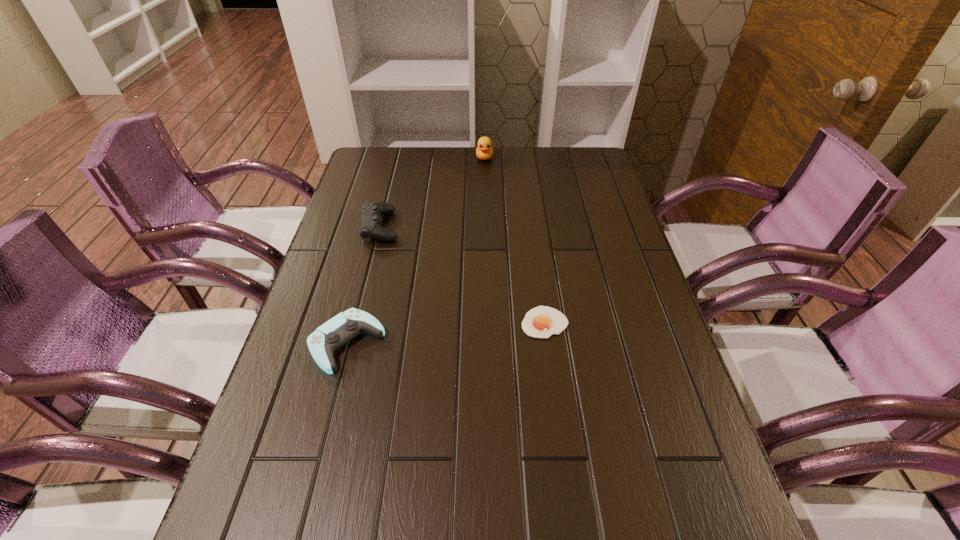
At what (x,y) coordinates should I click in order to perform the action: click on vacant point located on the front of the third tallest object. Please return your answer as a coordinate pair (x, y). Image resolution: width=960 pixels, height=540 pixels. Looking at the image, I should click on (321, 443).

Locate an element on the screen. vacant space located on the right of the egg yolk is located at coordinates (648, 322).

Where is `object at the far edge`? The image size is (960, 540). object at the far edge is located at coordinates (484, 151).

This screenshot has height=540, width=960. What are the coordinates of `free space at the far edge of the desktop` in the screenshot? It's located at (429, 156).

The image size is (960, 540). I want to click on free space at the left edge of the desktop, so click(x=356, y=194).

The width and height of the screenshot is (960, 540). I want to click on vacant region at the right edge of the desktop, so pyautogui.click(x=703, y=515).

In the image, there is a desktop. What are the coordinates of `vacant space at the far left corner` in the screenshot? It's located at (389, 183).

The width and height of the screenshot is (960, 540). Find the location of `vacant space at the far right corner of the desktop`. vacant space at the far right corner of the desktop is located at coordinates (572, 177).

What are the coordinates of `free space between the farthest object and the egg yolk` in the screenshot? It's located at (515, 240).

Identify the location of free space between the second object from right to left and the taller control. The height and width of the screenshot is (540, 960). (432, 192).